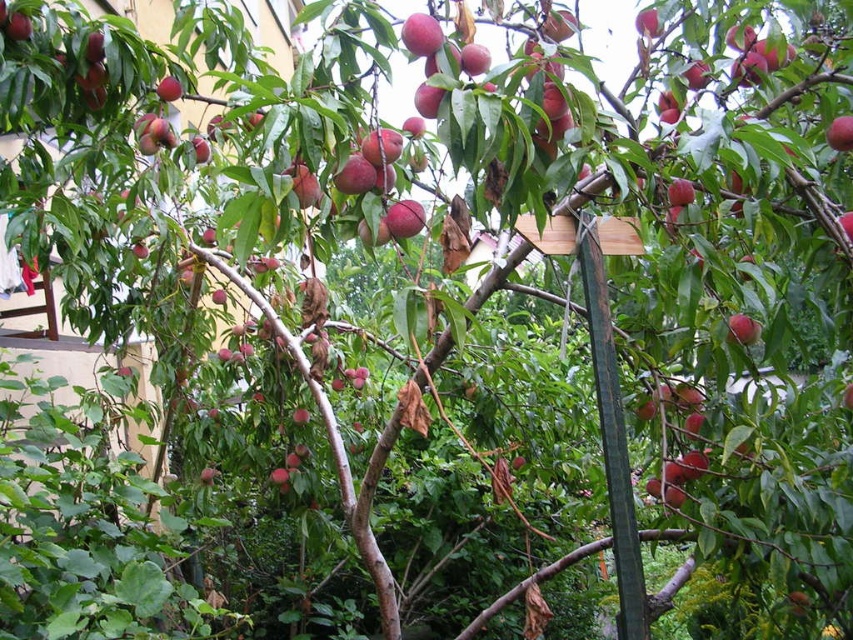
You are standing in front of the peach tree and want to pick the smooth red peach at center. Based on its position, where exactly should you look to find it?

The smooth red peach at center is located at the 2D coordinates point [741,330], so you should look towards the center of the tree slightly towards the right to find it.

Based on the photo, you are a gardener standing at the base of the peach tree holding a basket. You need to pick the matte red peach at upper left. The green wood pole at center is leaning against the tree. Can you reach the peach by using the pole to extend your reach?

The green wood pole at center is 1.46 meters away from the matte red peach at upper left. Since the pole is likely shorter than this distance, you may not be able to reach the peach with just the pole.